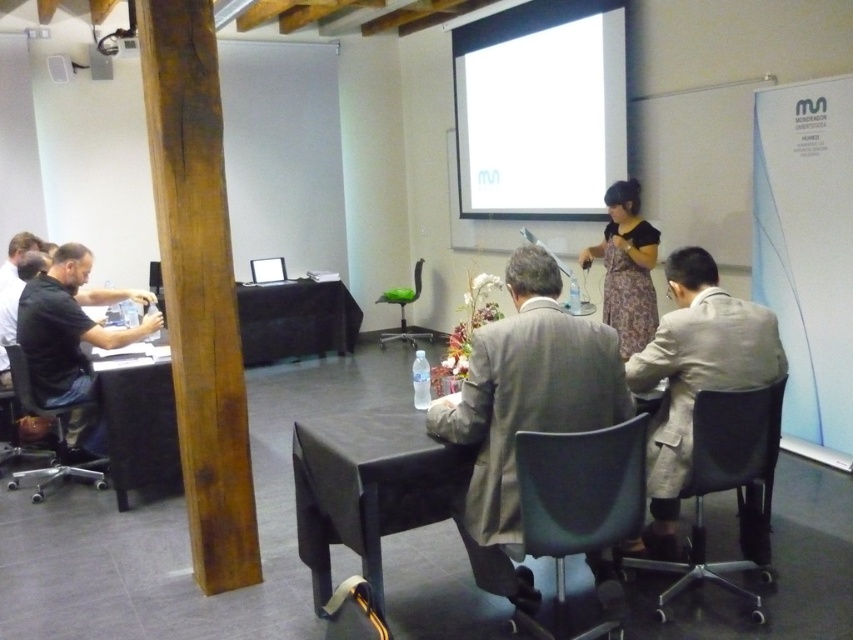
Question: Which point is farther from the camera taking this photo?

Choices:
 (A) (347, 301)
 (B) (686, 260)
 (C) (595, 496)
 (D) (99, 461)

Answer: (A)

Question: Which is nearer to the light brown suit at center?

Choices:
 (A) brown wooden pillar at left
 (B) black matte shirt at left
 (C) matte plastic chair at center
 (D) white matte projection screen at upper center

Answer: (C)

Question: Which of the following is the farthest from the observer?

Choices:
 (A) (590, 388)
 (B) (171, 416)
 (C) (613, 182)
 (D) (321, 499)

Answer: (C)

Question: Does light brown suit at center have a greater width compared to black matte shirt at left?

Choices:
 (A) yes
 (B) no

Answer: (B)

Question: Is light brown suit at center bigger than floral dress at center?

Choices:
 (A) yes
 (B) no

Answer: (A)

Question: Does black matte shirt at left have a greater width compared to floral dress at center?

Choices:
 (A) no
 (B) yes

Answer: (B)